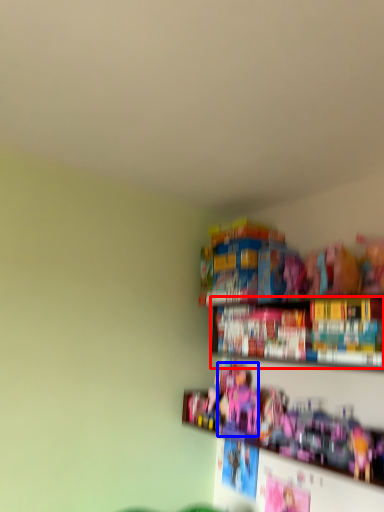
Question: Which object appears farthest to the camera in this image, book (highlighted by a red box) or toy (highlighted by a blue box)?

Choices:
 (A) book
 (B) toy

Answer: (B)